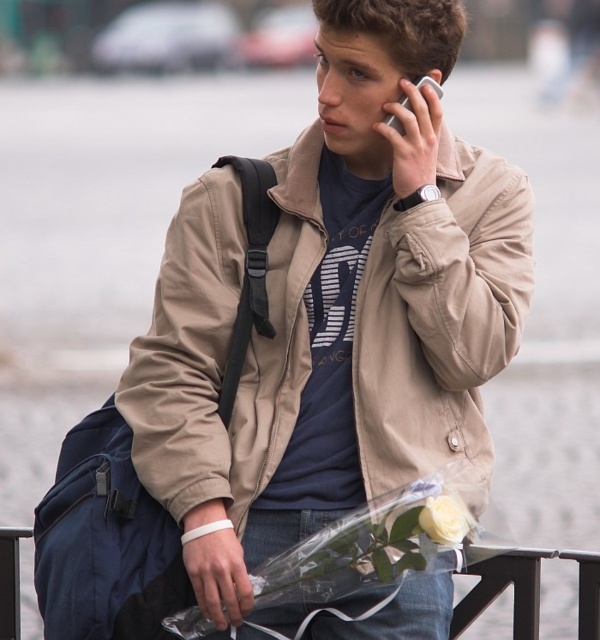
Between point (97, 600) and point (498, 570), which one is positioned in front?

Point (97, 600)

Can you confirm if navy blue fabric backpack at lower left is shorter than clear plastic rail at lower center?

Indeed, navy blue fabric backpack at lower left has a lesser height compared to clear plastic rail at lower center.

At what (x,y) coordinates should I click in order to perform the action: click on navy blue fabric backpack at lower left. Please return your answer as a coordinate pair (x, y). This screenshot has height=640, width=600. Looking at the image, I should click on (105, 541).

Is point (459, 282) positioned after point (4, 620)?

No, (459, 282) is in front of (4, 620).

Does tan fabric jacket at center appear under clear plastic rail at lower center?

Actually, tan fabric jacket at center is above clear plastic rail at lower center.

Is point (402, 342) closer to viewer compared to point (472, 602)?

Yes, it is in front of point (472, 602).

I want to click on tan fabric jacket at center, so click(x=223, y=342).

Does point (525, 634) lie in front of point (388, 116)?

No, it is behind (388, 116).

Does clear plastic rail at lower center appear under silver metallic smartphone at upper right?

Yes, clear plastic rail at lower center is below silver metallic smartphone at upper right.

Is point (31, 534) in front of point (408, 109)?

No, it is behind (408, 109).

The height and width of the screenshot is (640, 600). I want to click on clear plastic rail at lower center, so click(529, 589).